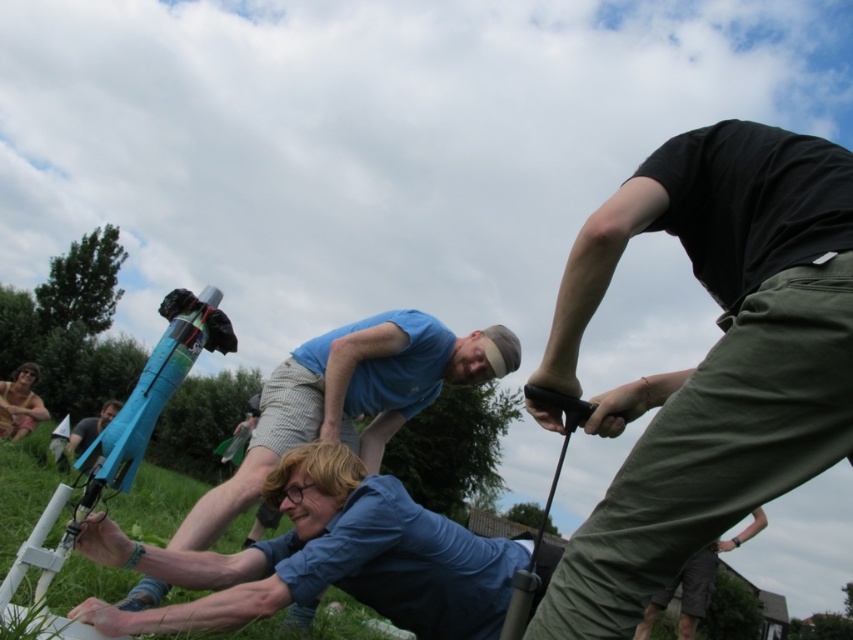
Based on the photo, which of these two, black cotton shirt at upper right or brown textured fabric at lower left, stands taller?

Standing taller between the two is black cotton shirt at upper right.

Between black cotton shirt at upper right and brown textured fabric at lower left, which one appears on the right side from the viewer's perspective?

Positioned to the right is black cotton shirt at upper right.

The height and width of the screenshot is (640, 853). Identify the location of black cotton shirt at upper right. (711, 358).

You are a GUI agent. You are given a task and a screenshot of the screen. Output one action in this format:
    pyautogui.click(x=<x>, y=<y>)
    Task: Click on the black cotton shirt at upper right
    The width and height of the screenshot is (853, 640).
    Given the screenshot: What is the action you would take?
    pyautogui.click(x=711, y=358)

Does point (718, 144) come behind point (109, 401)?

No, it is not.

How far apart are black cotton shirt at upper right and matte blue rocket at left?

black cotton shirt at upper right is 8.76 feet away from matte blue rocket at left.

Find the location of a particular element. Image resolution: width=853 pixels, height=640 pixels. black cotton shirt at upper right is located at coordinates coord(711,358).

Find the location of a particular element. This screenshot has width=853, height=640. black cotton shirt at upper right is located at coordinates (711, 358).

Does green grass at lower left have a smaller size compared to matte blue rocket at left?

Yes.

Is green grass at lower left to the right of matte blue rocket at left from the viewer's perspective?

Yes, green grass at lower left is to the right of matte blue rocket at left.

Find the location of a particular element. The height and width of the screenshot is (640, 853). green grass at lower left is located at coordinates (42, 572).

Find the location of a particular element. The image size is (853, 640). green grass at lower left is located at coordinates point(42,572).